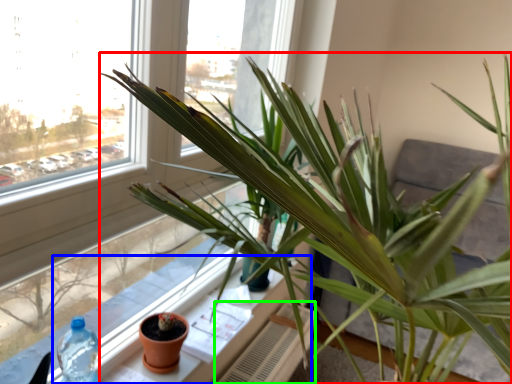
Question: Which object is positioned closest to houseplant (highlighted by a red box)? Select from window sill (highlighted by a blue box) and radiator (highlighted by a green box).

Choices:
 (A) window sill
 (B) radiator

Answer: (A)